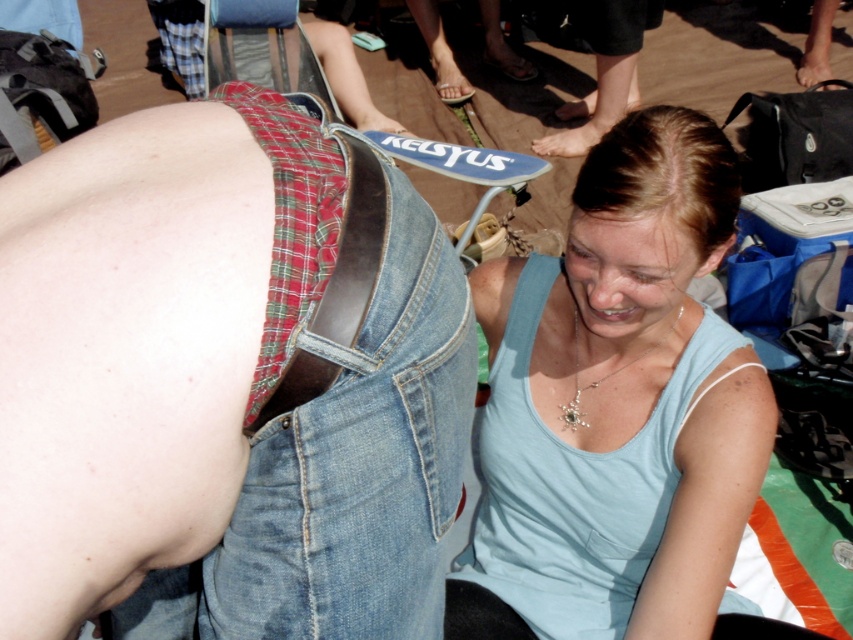
You are a photographer trying to capture a closeup shot of the light blue tank top at center and the leather belt at center. Since you want to focus on both items equally, which one should you zoom in on more?

The light blue tank top at center is larger in size than the leather belt at center, so you should zoom in more on the leather belt at center to ensure both appear equally sized in the photo.